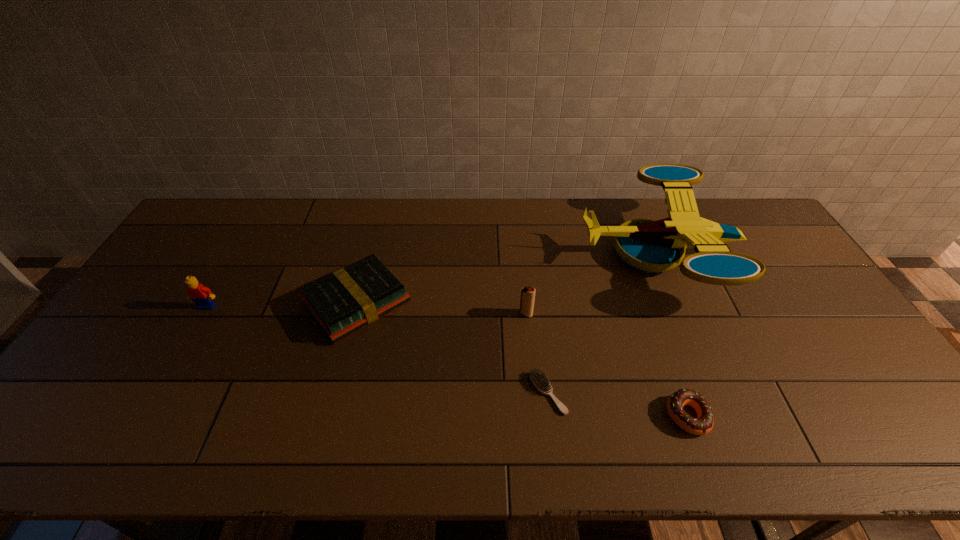
This screenshot has width=960, height=540. I want to click on free location located 0.230m on the face of the Lego, so click(x=165, y=379).

The height and width of the screenshot is (540, 960). What are the coordinates of `free space located on the right of the igniter` in the screenshot? It's located at (594, 314).

Image resolution: width=960 pixels, height=540 pixels. I want to click on free space located on the left of the third shortest object, so click(240, 303).

The width and height of the screenshot is (960, 540). What are the coordinates of `free point located on the left of the second shortest object` in the screenshot? It's located at (594, 416).

The width and height of the screenshot is (960, 540). Identify the location of free space located on the right of the scrubbing brush. (597, 393).

At what (x,y) coordinates should I click in order to perform the action: click on object that is positioned at the far edge. Please return your answer as a coordinate pair (x, y). This screenshot has height=540, width=960. Looking at the image, I should click on (652, 246).

Image resolution: width=960 pixels, height=540 pixels. Find the location of `object present at the near edge`. object present at the near edge is located at coordinates (703, 424).

In the image, there is a desktop. Identify the location of vacant space at the far edge. (610, 211).

Identify the location of vacant space at the near edge of the desktop. (282, 427).

Where is `free space at the right edge of the desktop`? free space at the right edge of the desktop is located at coordinates (769, 249).